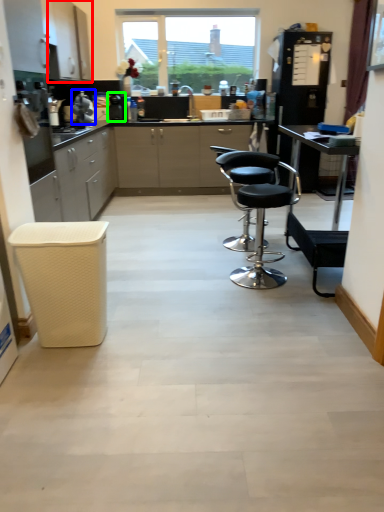
Question: Estimate the real-world distances between objects in this image. Which object is farther from cabinetry (highlighted by a red box), appliance (highlighted by a blue box) or appliance (highlighted by a green box)?

Choices:
 (A) appliance
 (B) appliance

Answer: (B)